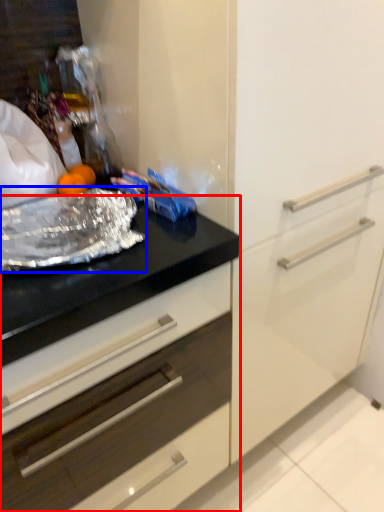
Question: Among these objects, which one is farthest to the camera, countertop (highlighted by a red box) or material (highlighted by a blue box)?

Choices:
 (A) countertop
 (B) material

Answer: (B)